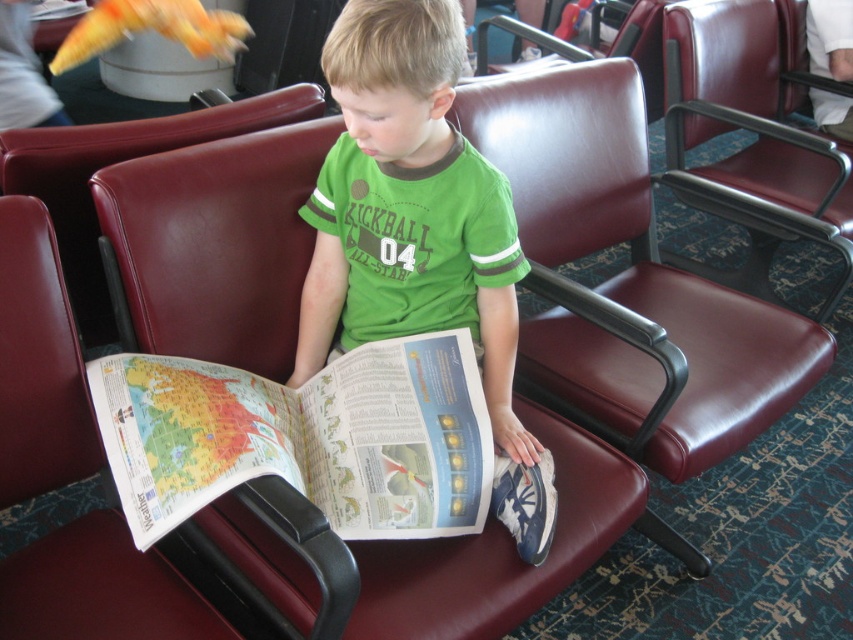
Question: Can you confirm if green jersey at center is positioned below maroon leather chair at center?

Choices:
 (A) yes
 (B) no

Answer: (A)

Question: Among these points, which one is nearest to the camera?

Choices:
 (A) (695, 180)
 (B) (434, 248)

Answer: (B)

Question: Does printed paper map at center have a smaller size compared to maroon leather armchair at center?

Choices:
 (A) no
 (B) yes

Answer: (B)

Question: Is green jersey at center bigger than printed paper map at center?

Choices:
 (A) yes
 (B) no

Answer: (A)

Question: Considering the real-world distances, which object is closest to the printed paper map at center?

Choices:
 (A) maroon leather armchair at center
 (B) maroon leather chair at center

Answer: (B)

Question: Which point is closer to the camera taking this photo?

Choices:
 (A) (122, 381)
 (B) (740, 115)
 (C) (427, 292)
 (D) (177, 138)

Answer: (A)